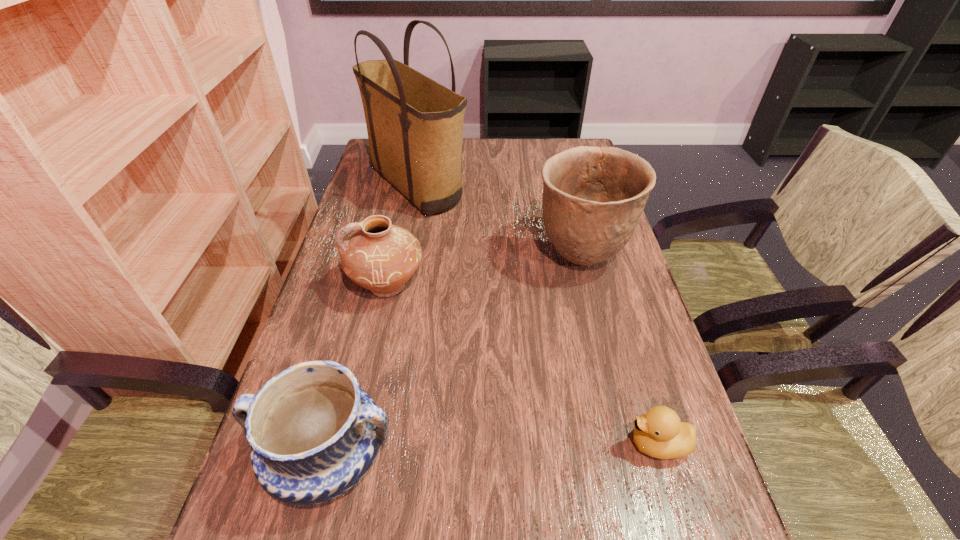
Where is `free space that satisfies the following two spatial constraints: 1. on the back side of the nearest pottery; 2. on the right side of the second tallest object`? free space that satisfies the following two spatial constraints: 1. on the back side of the nearest pottery; 2. on the right side of the second tallest object is located at coordinates 379,258.

You are a GUI agent. You are given a task and a screenshot of the screen. Output one action in this format:
    pyautogui.click(x=<x>, y=<y>)
    Task: Click on the vacant region that satisfies the following two spatial constraints: 1. on the back side of the tallest pottery; 2. on the left side of the nearest pottery
    The width and height of the screenshot is (960, 540).
    Given the screenshot: What is the action you would take?
    (379, 258)